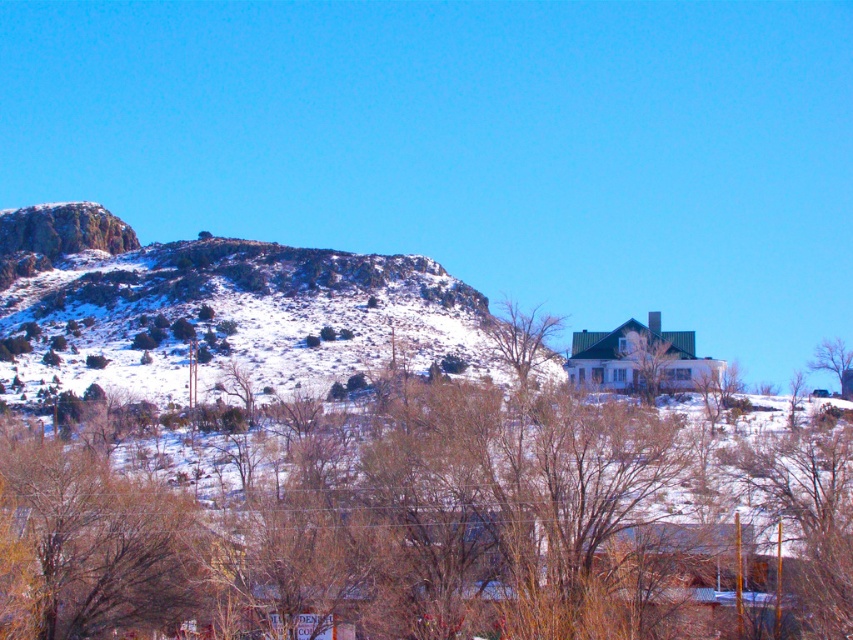
You are an architect designing a new garden layout. You need to place a bench between the brown leafless tree at center and the green matte house at center. Given their sizes, which object should the bench be closer to to ensure it doesn

The bench should be placed closer to the green matte house at center because the brown leafless tree at center is wider than the house, requiring more space around it to accommodate its spread.

You are an observer looking at the winter landscape. You notice the green matte house at center and the bare branches at upper right. Which object is positioned closer to you?

The green matte house at center is closer to the viewer than the bare branches at upper right.